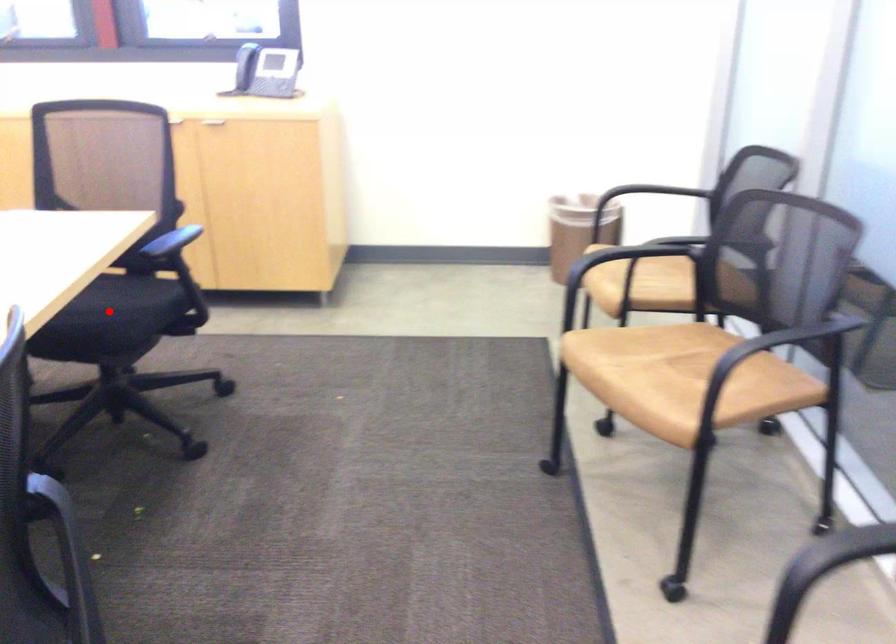
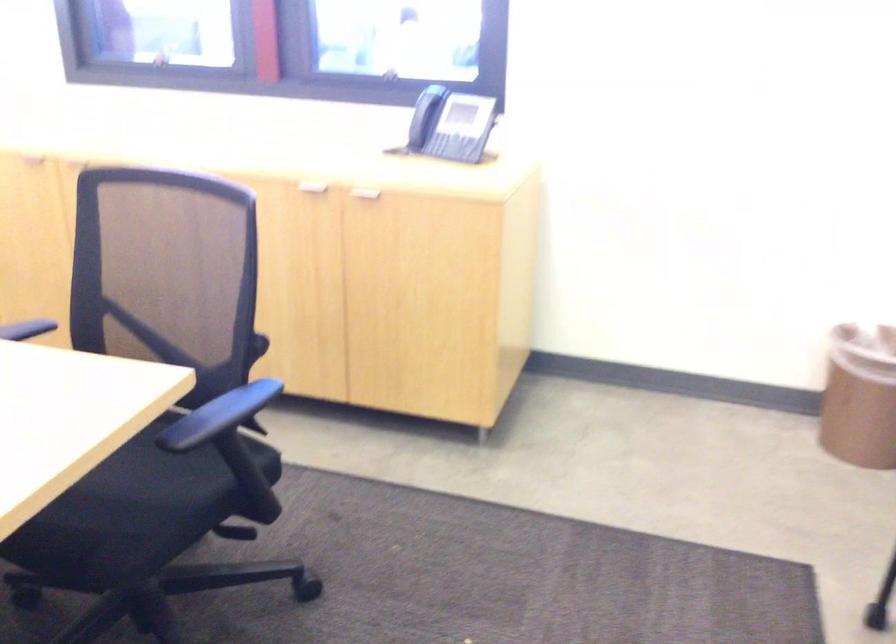
Question: A red point is marked in image1. In image2, is the corresponding 3D point closer to the camera or farther? Reply with the corresponding letter.

Choices:
 (A) The corresponding 3D point is closer.
 (B) The corresponding 3D point is farther.

Answer: (A)